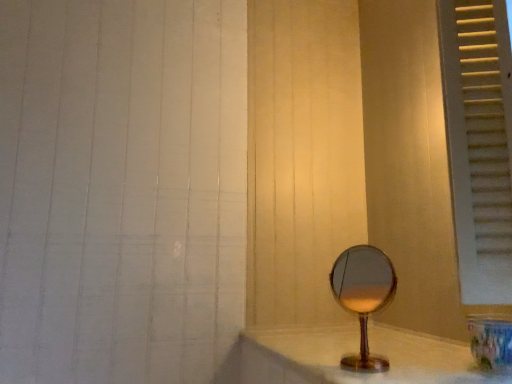
You are a GUI agent. You are given a task and a screenshot of the screen. Output one action in this format:
    pyautogui.click(x=<x>, y=<y>)
    Task: Click on the translucent glass mirror at lower right
    The width and height of the screenshot is (512, 384).
    Given the screenshot: What is the action you would take?
    pyautogui.click(x=352, y=352)

Considering the sizes of objects translucent glass mirror at lower right and white painted wood window frame at right in the image provided, who is bigger, translucent glass mirror at lower right or white painted wood window frame at right?

With larger size is white painted wood window frame at right.

Considering the sizes of objects translucent glass mirror at lower right and white painted wood window frame at right in the image provided, who is taller, translucent glass mirror at lower right or white painted wood window frame at right?

Result: With more height is white painted wood window frame at right.

Is translucent glass mirror at lower right far away from white painted wood window frame at right?

Actually, translucent glass mirror at lower right and white painted wood window frame at right are a little close together.

Is white painted wood window frame at right touching wooden mirror at center?

No, white painted wood window frame at right is not in contact with wooden mirror at center.

Which of these two, white painted wood window frame at right or wooden mirror at center, is thinner?

With smaller width is wooden mirror at center.

Does white painted wood window frame at right have a greater height compared to wooden mirror at center?

Indeed, white painted wood window frame at right has a greater height compared to wooden mirror at center.

Is white painted wood window frame at right facing towards wooden mirror at center?

No, white painted wood window frame at right is not aimed at wooden mirror at center.

Which is closer, [344,257] or [433,367]?

The point [433,367] is closer.

From the picture: Is translucent glass mirror at lower right completely or partially inside wooden mirror at center?

Actually, translucent glass mirror at lower right is outside wooden mirror at center.

Is wooden mirror at center facing away from translucent glass mirror at lower right?

That's right, wooden mirror at center is facing away from translucent glass mirror at lower right.

From the image's perspective, which is below, wooden mirror at center or translucent glass mirror at lower right?

translucent glass mirror at lower right appears lower in the image.

From their relative heights in the image, would you say wooden mirror at center is taller or shorter than white painted wood window frame at right?

Considering their sizes, wooden mirror at center has less height than white painted wood window frame at right.

Is wooden mirror at center situated inside white painted wood window frame at right or outside?

wooden mirror at center is located beyond the bounds of white painted wood window frame at right.

Considering the positions of objects wooden mirror at center and white painted wood window frame at right in the image provided, who is in front, wooden mirror at center or white painted wood window frame at right?

Positioned in front is white painted wood window frame at right.

Which object is closer to the camera taking this photo, translucent glass mirror at lower right or wooden mirror at center?

translucent glass mirror at lower right is in front.

Is translucent glass mirror at lower right facing towards wooden mirror at center?

No, translucent glass mirror at lower right is not oriented towards wooden mirror at center.

Which is closer to the camera, (314,381) or (360,362)?

The point (314,381) is closer to the camera.

From a real-world perspective, is white painted wood window frame at right on top of translucent glass mirror at lower right?

Indeed, from a real-world perspective, white painted wood window frame at right stands above translucent glass mirror at lower right.

Considering the sizes of objects white painted wood window frame at right and translucent glass mirror at lower right in the image provided, who is bigger, white painted wood window frame at right or translucent glass mirror at lower right?

white painted wood window frame at right.

In the image, is white painted wood window frame at right positioned in front of or behind translucent glass mirror at lower right?

Clearly, white painted wood window frame at right is in front of translucent glass mirror at lower right.

Could you tell me if white painted wood window frame at right is facing translucent glass mirror at lower right?

No, white painted wood window frame at right is not turned towards translucent glass mirror at lower right.

This screenshot has height=384, width=512. I want to click on counter top below the white painted wood window frame at right (from a real-world perspective), so click(x=352, y=352).

Find the location of `window frame above the wooden mirror at center (from a real-world perspective)`. window frame above the wooden mirror at center (from a real-world perspective) is located at coordinates (479, 143).

Looking at the image, which one is located further to white painted wood window frame at right, translucent glass mirror at lower right or wooden mirror at center?

The object further to white painted wood window frame at right is translucent glass mirror at lower right.

Based on their spatial positions, is translucent glass mirror at lower right or white painted wood window frame at right further from wooden mirror at center?

white painted wood window frame at right lies further to wooden mirror at center than the other object.

Based on their spatial positions, is wooden mirror at center or translucent glass mirror at lower right closer to white painted wood window frame at right?

The object closer to white painted wood window frame at right is wooden mirror at center.

Consider the image. Considering their positions, is wooden mirror at center positioned closer to translucent glass mirror at lower right than white painted wood window frame at right?

The object closer to translucent glass mirror at lower right is wooden mirror at center.

From the image, which object appears to be nearer to wooden mirror at center, white painted wood window frame at right or translucent glass mirror at lower right?

translucent glass mirror at lower right.

Considering their positions, is white painted wood window frame at right positioned further to translucent glass mirror at lower right than wooden mirror at center?

Among the two, white painted wood window frame at right is located further to translucent glass mirror at lower right.

You are a GUI agent. You are given a task and a screenshot of the screen. Output one action in this format:
    pyautogui.click(x=<x>, y=<y>)
    Task: Click on the mirror between white painted wood window frame at right and translucent glass mirror at lower right vertically
    This screenshot has height=384, width=512.
    Given the screenshot: What is the action you would take?
    point(362,297)